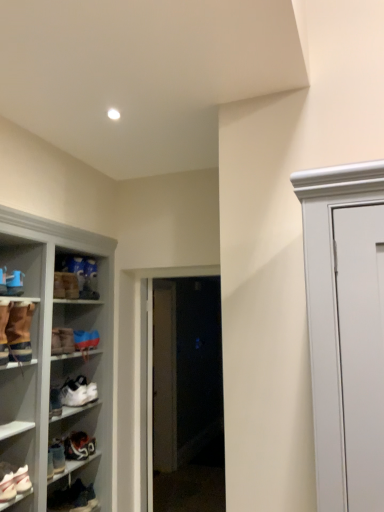
Question: Is transparent glass door at center taller or shorter than white leather sneaker at lower left, which is the seventh footwear in top-to-bottom order?

Choices:
 (A) tall
 (B) short

Answer: (A)

Question: From the image's perspective, is transparent glass door at center positioned above or below white leather sneaker at lower left, which appears as the 2th footwear when ordered from the bottom?

Choices:
 (A) below
 (B) above

Answer: (B)

Question: Which of these objects is positioned closest to the brown suede boot at left, the sixth footwear positioned from the bottom?

Choices:
 (A) white leather sneaker at lower left, which appears as the 2th footwear when ordered from the bottom
 (B) matte brown boot at upper left, the seventh footwear in the bottom-to-top sequence
 (C) white matte sneaker at lower left, marked as the fourth footwear in a bottom-to-top arrangement
 (D) white leather sneakers at lower left, the 6th footwear positioned from the top
 (E) transparent glass door at center

Answer: (B)

Question: Which object is positioned closest to the white leather sneaker at lower left, which appears as the 2th footwear when ordered from the bottom?

Choices:
 (A) matte blue sneaker at left, which is the 1th footwear in top-to-bottom order
 (B) white matte sneaker at lower left, marked as the fourth footwear in a bottom-to-top arrangement
 (C) brown suede boot at left, the sixth footwear positioned from the bottom
 (D) transparent glass door at center
 (E) blue suede sneakers at lower left, the fifth footwear when ordered from bottom to top

Answer: (B)